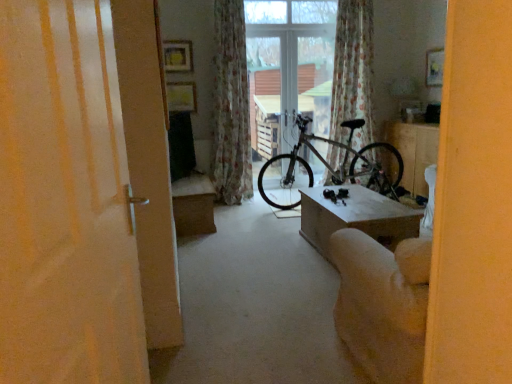
Question: Is light brown wooden table at center, which ranks as the first table in left-to-right order, at the back of floral fabric curtain at upper center, positioned as the 2th curtain in left-to-right order?

Choices:
 (A) no
 (B) yes

Answer: (A)

Question: Is floral fabric curtain at upper center, the first curtain viewed from the right, bigger than light brown wooden table at center, the 2th table when ordered from right to left?

Choices:
 (A) yes
 (B) no

Answer: (A)

Question: Would you say floral fabric curtain at upper center, the first curtain viewed from the right, is a long distance from light brown wooden table at center, the 2th table when ordered from right to left?

Choices:
 (A) yes
 (B) no

Answer: (A)

Question: Considering the relative sizes of floral fabric curtain at upper center, positioned as the 2th curtain in left-to-right order, and light brown wooden table at center, placed as the 2th table when sorted from back to front, in the image provided, is floral fabric curtain at upper center, positioned as the 2th curtain in left-to-right order, wider than light brown wooden table at center, placed as the 2th table when sorted from back to front,?

Choices:
 (A) no
 (B) yes

Answer: (A)

Question: Is floral fabric curtain at upper center, positioned as the 2th curtain in left-to-right order, touching light brown wooden table at center, placed as the 2th table when sorted from back to front?

Choices:
 (A) yes
 (B) no

Answer: (B)

Question: Is point (369, 226) closer or farther from the camera than point (404, 139)?

Choices:
 (A) closer
 (B) farther

Answer: (A)

Question: In terms of width, does light brown wooden table at center, placed as the 2th table when sorted from back to front, look wider or thinner when compared to white glossy table at center, the second table in the front-to-back sequence?

Choices:
 (A) wide
 (B) thin

Answer: (A)

Question: In the image, is light brown wooden table at center, which is the 1th table in front-to-back order, positioned in front of or behind white glossy table at center, positioned as the 1th table in right-to-left order?

Choices:
 (A) behind
 (B) front

Answer: (B)

Question: Is light brown wooden table at center, placed as the 2th table when sorted from back to front, to the left or to the right of white glossy table at center, the second table in the left-to-right sequence, in the image?

Choices:
 (A) right
 (B) left

Answer: (B)

Question: Looking at their shapes, would you say matte white door at left is wider or thinner than beige fabric armchair at lower right?

Choices:
 (A) wide
 (B) thin

Answer: (B)

Question: Based on their sizes in the image, would you say matte white door at left is bigger or smaller than beige fabric armchair at lower right?

Choices:
 (A) small
 (B) big

Answer: (A)

Question: Is point (138, 329) positioned closer to the camera than point (399, 334)?

Choices:
 (A) farther
 (B) closer

Answer: (B)

Question: From the image's perspective, relative to beige fabric armchair at lower right, is matte white door at left above or below?

Choices:
 (A) below
 (B) above

Answer: (B)

Question: In terms of size, does white glossy table at center, the second table in the left-to-right sequence, appear bigger or smaller than silver metallic bicycle at center?

Choices:
 (A) big
 (B) small

Answer: (B)

Question: Considering the positions of white glossy table at center, the 1th table viewed from the back, and silver metallic bicycle at center in the image, is white glossy table at center, the 1th table viewed from the back, taller or shorter than silver metallic bicycle at center?

Choices:
 (A) short
 (B) tall

Answer: (A)